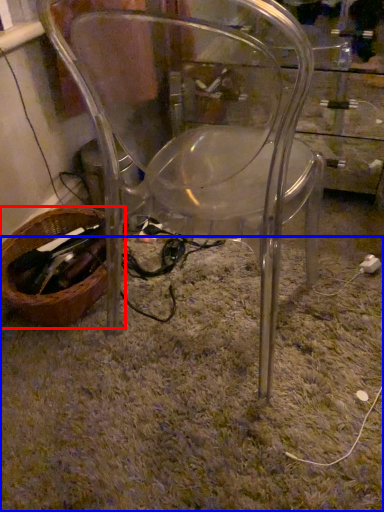
Question: Which of the following is the farthest to the observer, basket (highlighted by a red box) or grass (highlighted by a blue box)?

Choices:
 (A) basket
 (B) grass

Answer: (A)